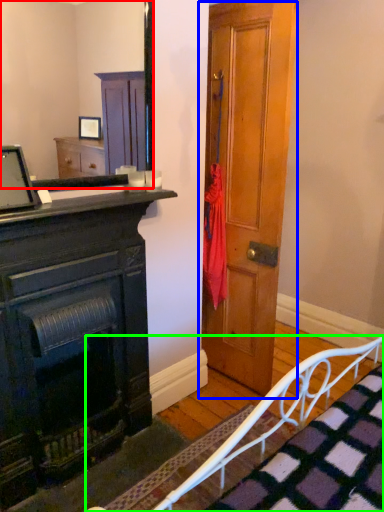
Question: Estimate the real-world distances between objects in this image. Which object is farther from mirror (highlighted by a red box), door (highlighted by a blue box) or bed frame (highlighted by a green box)?

Choices:
 (A) door
 (B) bed frame

Answer: (B)